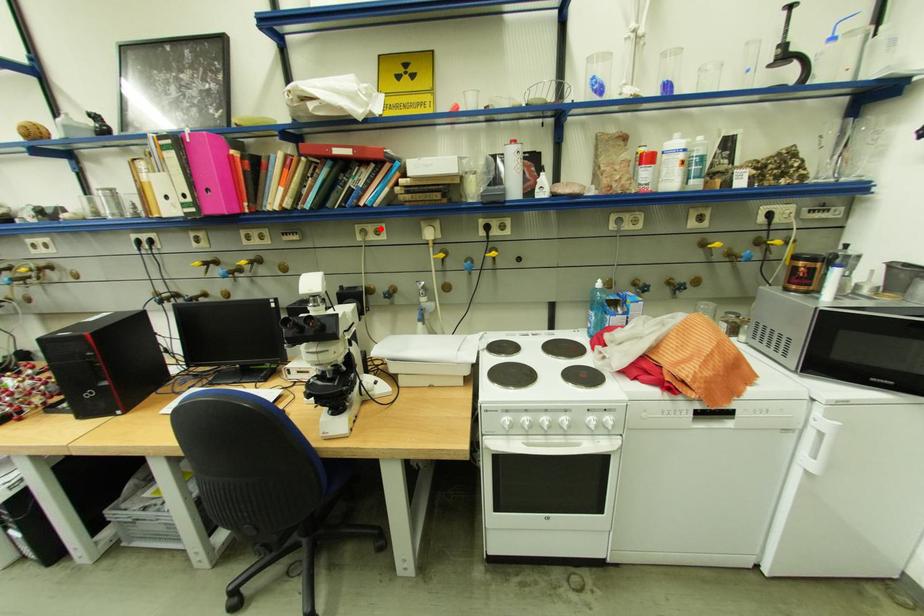
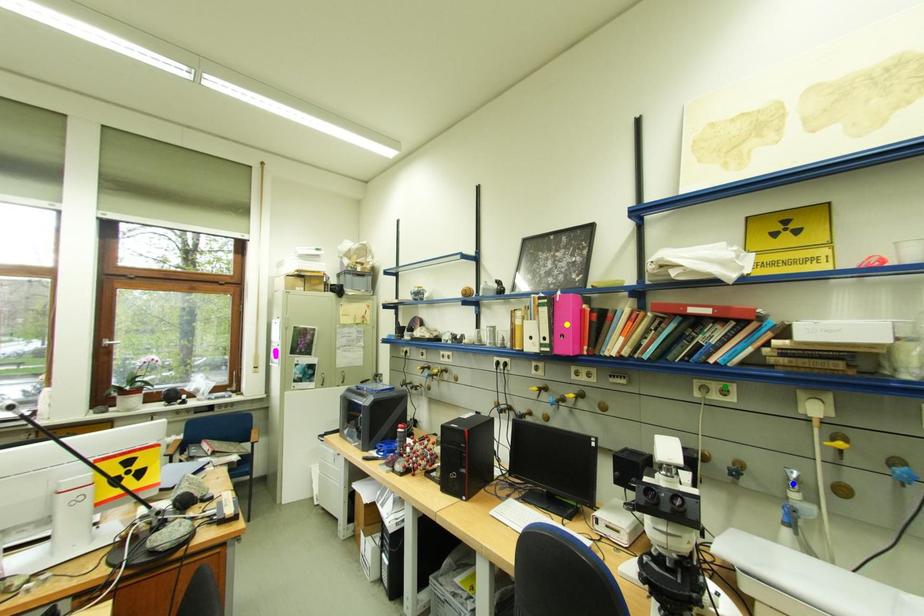
Question: I am providing you with two images of the same scene from different viewpoints. A red point is marked on the first image. You are given multiple points on the second image. Which point in image 2 is actually the same real-world point as the red point in image 1?

Choices:
 (A) yellow point
 (B) blue point
 (C) green point

Answer: (C)